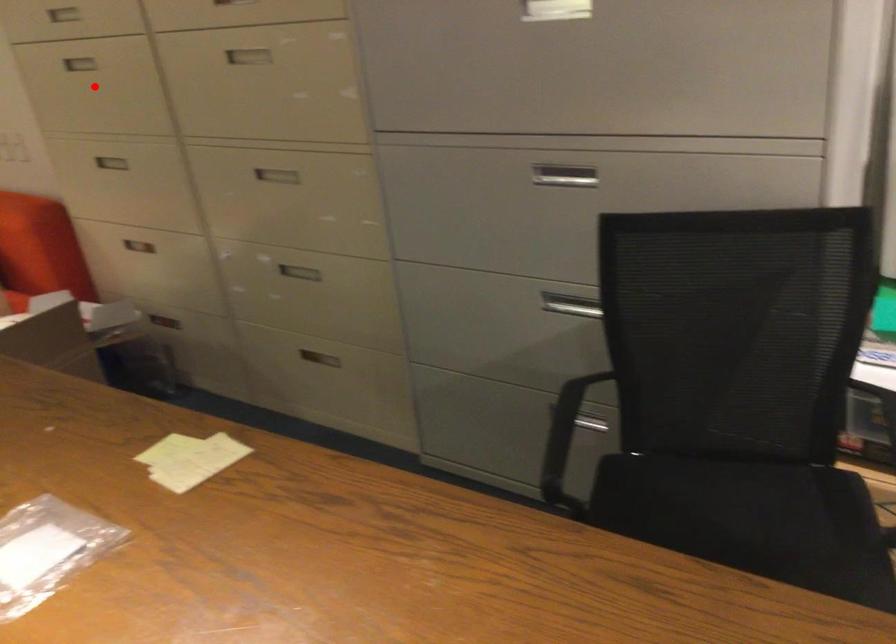
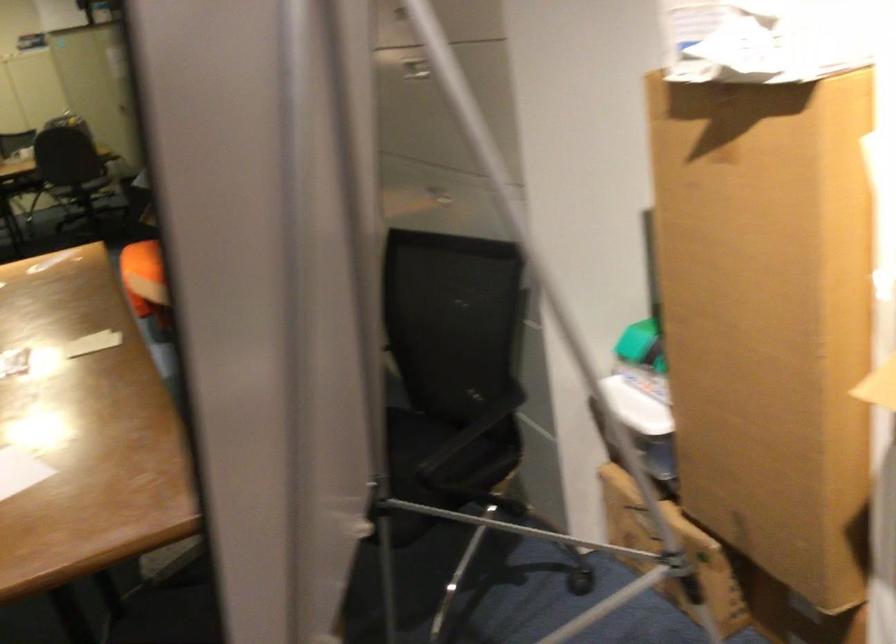
Question: I am providing you with two images of the same scene from different viewpoints. A red point is marked on the first image. At the location where the point appears in image 1, is it still visible in image 2?

Choices:
 (A) Yes
 (B) No

Answer: (B)